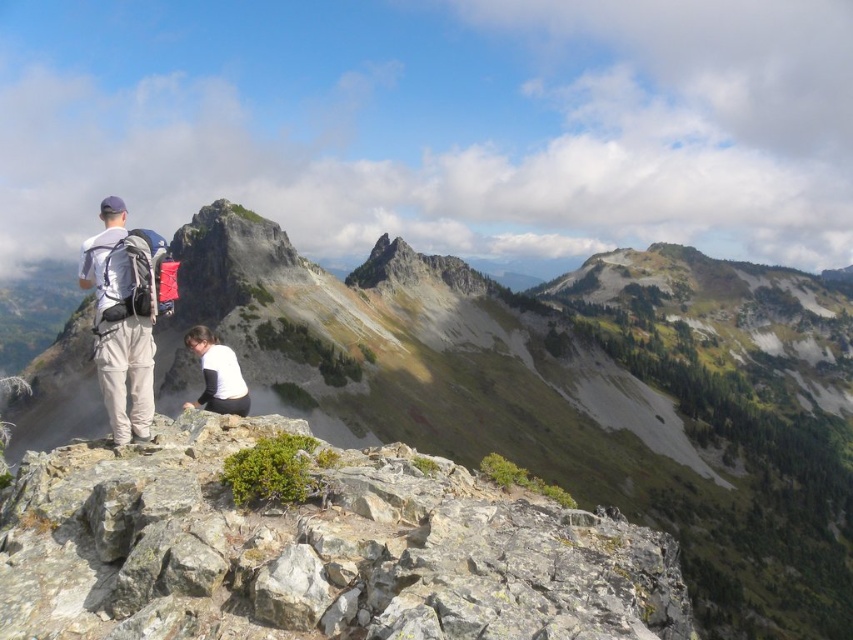
Question: Which point is farther to the camera?

Choices:
 (A) white matte shirt at center
 (B) gray rough rock at center
 (C) matte gray backpack at left
 (D) rugged stone mountain at upper center

Answer: (D)

Question: Is rugged stone mountain at upper center thinner than white matte shirt at center?

Choices:
 (A) no
 (B) yes

Answer: (A)

Question: Is rugged stone mountain at upper center in front of matte gray backpack at left?

Choices:
 (A) no
 (B) yes

Answer: (A)

Question: Which of the following is the closest to the observer?

Choices:
 (A) white matte shirt at center
 (B) matte gray backpack at left
 (C) rugged stone mountain at upper center

Answer: (B)

Question: Is gray rough rock at center below white matte shirt at center?

Choices:
 (A) no
 (B) yes

Answer: (B)

Question: Which is nearer to the rugged stone mountain at upper center?

Choices:
 (A) gray rough rock at center
 (B) matte gray backpack at left

Answer: (A)